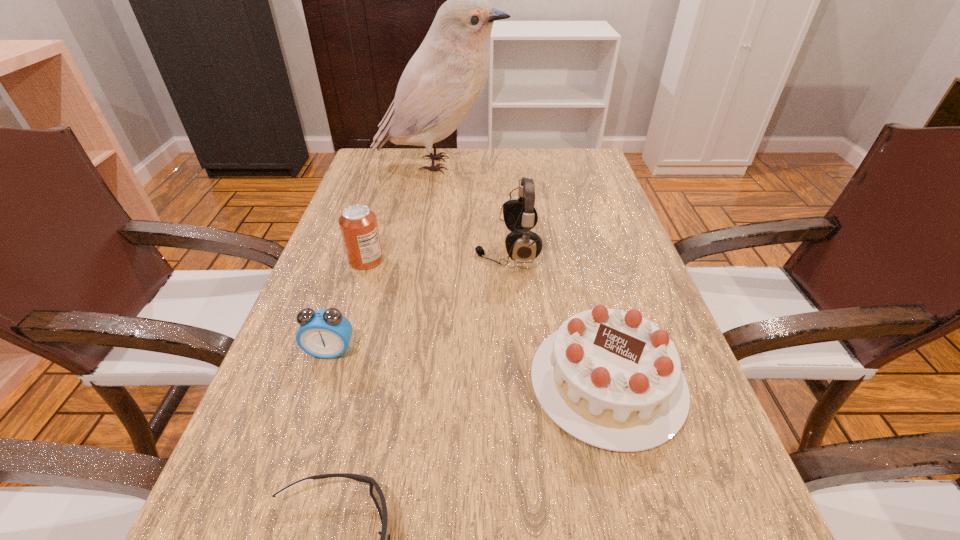
In the image, there is a desktop. Where is `free region at the left edge`? The height and width of the screenshot is (540, 960). free region at the left edge is located at coordinates (324, 426).

In the image, there is a desktop. Identify the location of free space at the right edge. (x=674, y=336).

Locate an element on the screen. The height and width of the screenshot is (540, 960). free point at the far left corner is located at coordinates (409, 176).

In the image, there is a desktop. Where is `free space at the far right corner`? This screenshot has width=960, height=540. free space at the far right corner is located at coordinates (564, 168).

Locate an element on the screen. This screenshot has height=540, width=960. free area in between the alarm clock and the birthday cake is located at coordinates (468, 366).

This screenshot has height=540, width=960. Identify the location of free point between the can and the birthday cake. (487, 321).

Locate an element on the screen. The height and width of the screenshot is (540, 960). empty location between the can and the alarm clock is located at coordinates (348, 306).

This screenshot has width=960, height=540. Identify the location of free space that is in between the tallest object and the can. (402, 212).

Where is `object that stands as the third closest to the shortest object`? object that stands as the third closest to the shortest object is located at coordinates (358, 224).

Locate an element on the screen. the third closest object to the can is located at coordinates (612, 379).